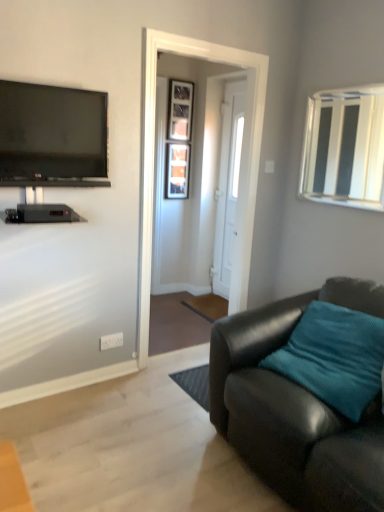
Question: Is matte black couch at lower right inside or outside of white glossy door at center?

Choices:
 (A) outside
 (B) inside

Answer: (A)

Question: Considering the positions of point (264, 419) and point (142, 355), is point (264, 419) closer or farther from the camera than point (142, 355)?

Choices:
 (A) closer
 (B) farther

Answer: (A)

Question: Which of these objects is positioned closest to the flat screen tv at upper left?

Choices:
 (A) matte black couch at lower right
 (B) white plastic power outlet at lower center
 (C) teal fabric pillow at lower right
 (D) white glossy door at center
 (E) wooden frame at center, arranged as the first window when viewed from the back

Answer: (B)

Question: Which of these objects is positioned closest to the wooden frame at center, arranged as the first window when viewed from the back?

Choices:
 (A) white glossy door at center
 (B) flat screen tv at upper left
 (C) white plastic window at upper right, which is the 2th window from left to right
 (D) teal fabric pillow at lower right
 (E) white glossy door at center

Answer: (E)